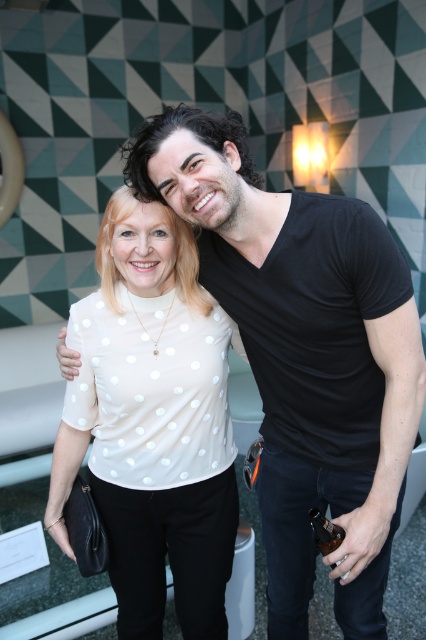
Question: Is white dotted shirt at center bigger than white dotted blouse at center?

Choices:
 (A) no
 (B) yes

Answer: (B)

Question: Can you confirm if white dotted shirt at center is positioned to the right of white dotted blouse at center?

Choices:
 (A) no
 (B) yes

Answer: (B)

Question: Which point is farther to the camera?

Choices:
 (A) (131, 214)
 (B) (224, 282)

Answer: (B)

Question: Which point is closer to the camera taking this photo?

Choices:
 (A) (213, 605)
 (B) (354, 490)

Answer: (B)

Question: Is white dotted shirt at center to the right of white dotted blouse at center from the viewer's perspective?

Choices:
 (A) yes
 (B) no

Answer: (A)